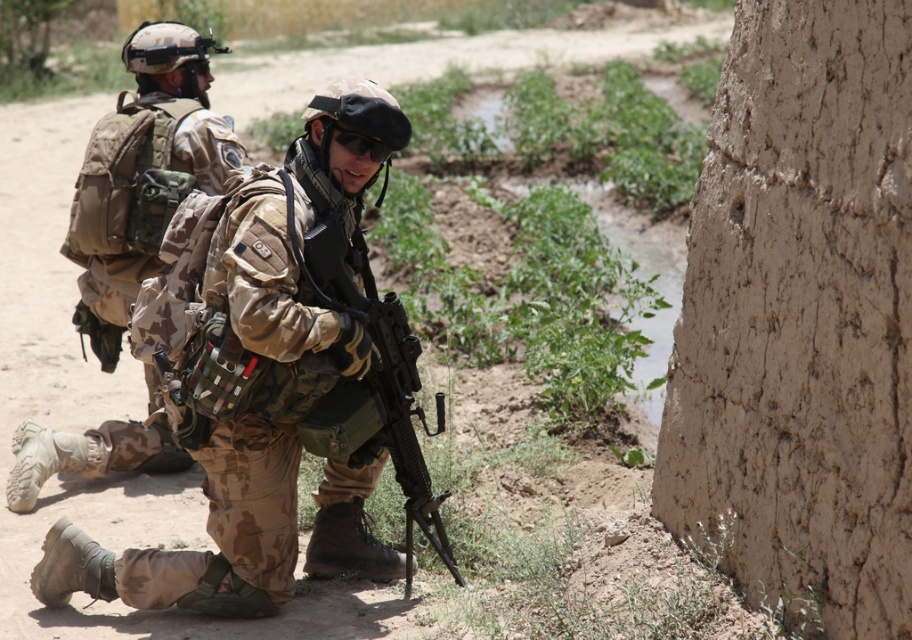
Question: Which point is farther to the camera?

Choices:
 (A) (137, 268)
 (B) (384, 369)
 (C) (81, 560)

Answer: (A)

Question: Which point is farther to the camera?

Choices:
 (A) camouflage fabric uniform at center
 (B) camouflage fabric uniform at left

Answer: (B)

Question: Can you confirm if camouflage fabric uniform at center is thinner than camouflage fabric uniform at left?

Choices:
 (A) no
 (B) yes

Answer: (A)

Question: Where is camouflage fabric uniform at center located in relation to matte black rifle at center in the image?

Choices:
 (A) below
 (B) above

Answer: (A)

Question: Among these points, which one is nearest to the camera?

Choices:
 (A) (322, 296)
 (B) (199, 168)

Answer: (A)

Question: Is camouflage fabric uniform at left closer to camera compared to matte black rifle at center?

Choices:
 (A) yes
 (B) no

Answer: (B)